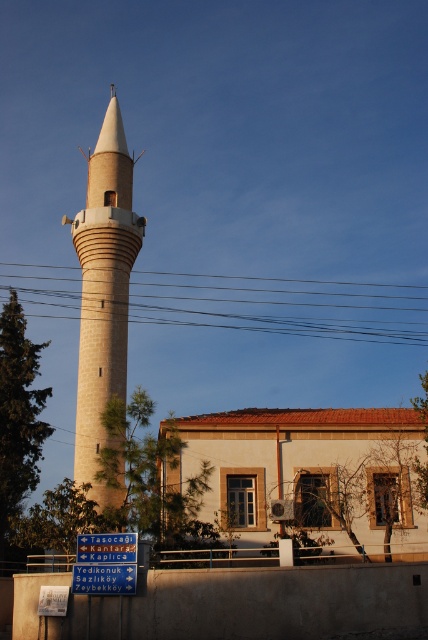
Question: Among these points, which one is nearest to the camera?

Choices:
 (A) (401, 300)
 (B) (112, 170)
 (C) (382, 481)

Answer: (C)

Question: Does beige stucco mosque at lower center have a smaller size compared to brown wire at center?

Choices:
 (A) yes
 (B) no

Answer: (B)

Question: Is beige stone minaret at center wider than brown wire at center?

Choices:
 (A) yes
 (B) no

Answer: (B)

Question: Which object is farther from the camera taking this photo?

Choices:
 (A) beige stucco mosque at lower center
 (B) beige stone minaret at center
 (C) brown wire at center

Answer: (C)

Question: Can you confirm if beige stucco mosque at lower center is positioned to the left of brown wire at center?

Choices:
 (A) no
 (B) yes

Answer: (A)

Question: Which is nearer to the beige stucco mosque at lower center?

Choices:
 (A) brown wire at center
 (B) beige stone minaret at center

Answer: (B)